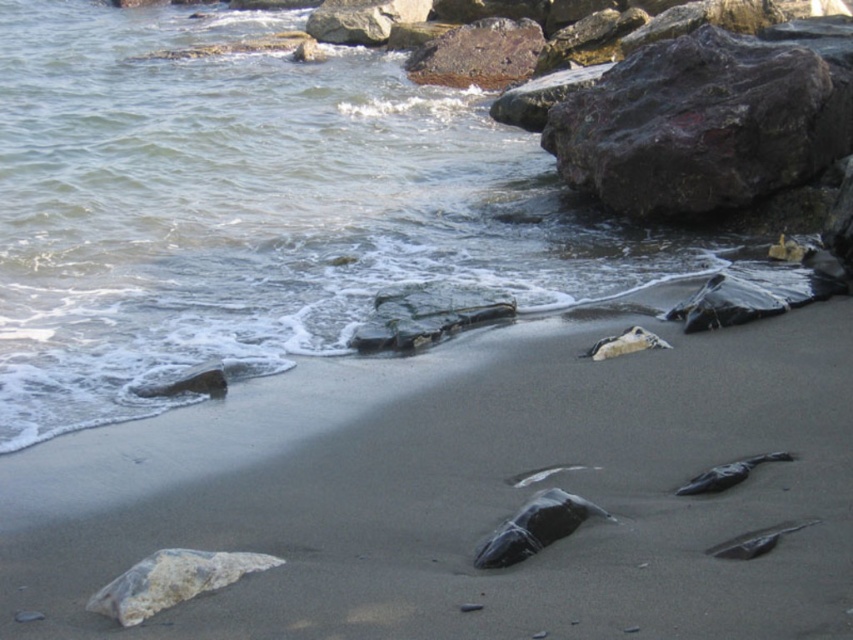
You are standing at the edge of the beach and want to walk towards the smooth sand at lower center. According to the coordinates provided, in which direction should you move relative to your current position?

The smooth sand at lower center is located at coordinates point (466, 492). Since the coordinate system typically places the origin at the bottom left corner, moving towards the right and slightly upwards from your current position would lead you to the smooth sand at lower center.